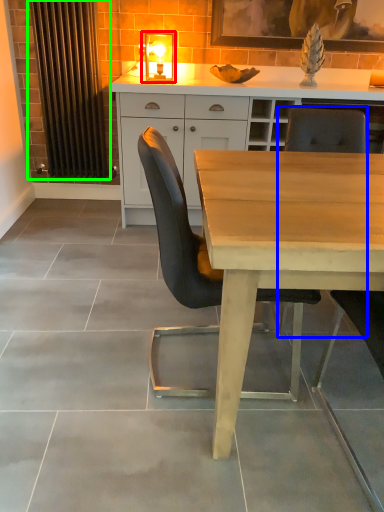
Question: Based on their relative distances, which object is nearer to light fixture (highlighted by a red box)? Choose from chair (highlighted by a blue box) and curtain (highlighted by a green box).

Choices:
 (A) chair
 (B) curtain

Answer: (B)